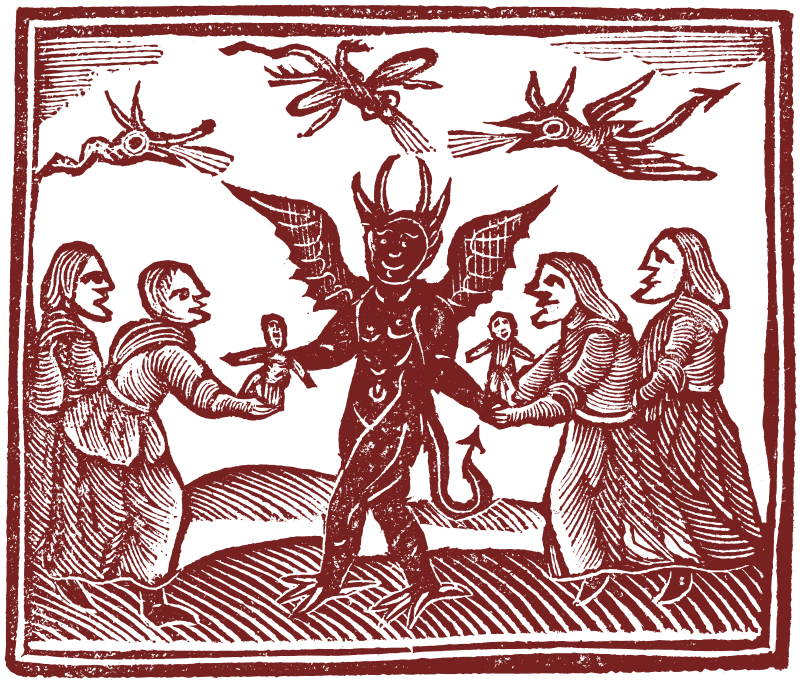
Locate instances of what looks to be a drawing in red charcoals in the image. Your answer should be formatted as a list of tuples, i.e. [(x1, y1), (x2, y2), ...], where each tuple contains the x and y coordinates of a point satisfying the conditions above.

[(406, 300)]